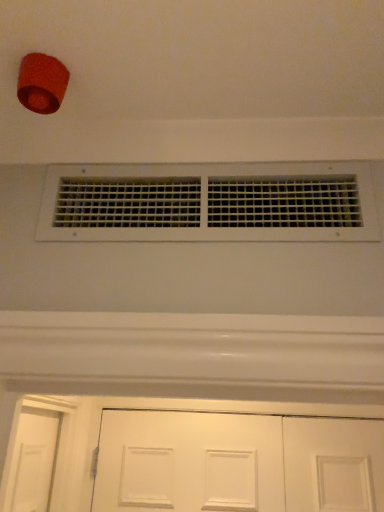
In order to click on white matte door at lower center in this screenshot , I will do `click(237, 462)`.

Describe the element at coordinates (237, 462) in the screenshot. I see `white matte door at lower center` at that location.

Locate an element on the screen. white plastic vents at center is located at coordinates (209, 203).

Describe the element at coordinates (209, 203) in the screenshot. I see `white plastic vents at center` at that location.

You are a GUI agent. You are given a task and a screenshot of the screen. Output one action in this format:
    pyautogui.click(x=<x>, y=<y>)
    Task: Click on the white matte door at lower center
    This screenshot has width=384, height=512.
    Given the screenshot: What is the action you would take?
    pyautogui.click(x=237, y=462)

Between white plastic vents at center and white matte door at lower center, which one appears on the left side from the viewer's perspective?

white plastic vents at center.

Is the depth of white plastic vents at center greater than that of white matte door at lower center?

No.

From the picture: Which point is more distant from viewer, (329, 229) or (262, 438)?

The point (262, 438) is farther.

From the image's perspective, between white plastic vents at center and white matte door at lower center, who is located below?

From the image's view, white matte door at lower center is below.

From a real-world perspective, is white plastic vents at center physically located above or below white matte door at lower center?

white plastic vents at center is situated higher than white matte door at lower center in the real world.

Considering the relative sizes of white plastic vents at center and white matte door at lower center in the image provided, is white plastic vents at center wider than white matte door at lower center?

No, white plastic vents at center is not wider than white matte door at lower center.

Is white plastic vents at center taller than white matte door at lower center?

In fact, white plastic vents at center may be shorter than white matte door at lower center.

Looking at this image, can you confirm if white plastic vents at center is bigger than white matte door at lower center?

Incorrect, white plastic vents at center is not larger than white matte door at lower center.

In the scene shown: Is white plastic vents at center positioned beyond the bounds of white matte door at lower center?

white plastic vents at center is positioned outside white matte door at lower center.

Consider the image. Is white plastic vents at center beside white matte door at lower center?

They are not placed beside each other.

Is white plastic vents at center positioned with its back to white matte door at lower center?

No, white plastic vents at center is not facing the opposite direction of white matte door at lower center.

How different are the orientations of white plastic vents at center and white matte door at lower center in degrees?

0.237 degrees.

Identify the location of window in front of the white matte door at lower center. (209, 203).

Between white matte door at lower center and white plastic vents at center, which one appears on the left side from the viewer's perspective?

white plastic vents at center.

Who is more distant, white matte door at lower center or white plastic vents at center?

Positioned behind is white matte door at lower center.

Considering the points (317, 444) and (157, 215), which point is in front, point (317, 444) or point (157, 215)?

The point (157, 215) is in front.

From the image's perspective, which is below, white matte door at lower center or white plastic vents at center?

From the image's view, white matte door at lower center is below.

From a real-world perspective, which object stands above the other?

white plastic vents at center, from a real-world perspective.

Looking at their sizes, would you say white matte door at lower center is wider or thinner than white plastic vents at center?

Clearly, white matte door at lower center has more width compared to white plastic vents at center.

Is white matte door at lower center taller than white plastic vents at center?

Correct, white matte door at lower center is much taller as white plastic vents at center.

Between white matte door at lower center and white plastic vents at center, which one has larger size?

Bigger between the two is white matte door at lower center.

Which is correct: white matte door at lower center is inside white plastic vents at center, or outside of it?

white matte door at lower center is located beyond the bounds of white plastic vents at center.

Would you consider white matte door at lower center to be distant from white plastic vents at center?

Absolutely, white matte door at lower center is distant from white plastic vents at center.

Looking at this image, is white matte door at lower center positioned with its back to white plastic vents at center?

No, white matte door at lower center is not facing away from white plastic vents at center.

Can you tell me how much white matte door at lower center and white plastic vents at center differ in facing direction?

The angular difference between white matte door at lower center and white plastic vents at center is 0.237 degrees.

How distant is white matte door at lower center from white plastic vents at center?

3.84 feet.

I want to click on window above the white matte door at lower center (from the image's perspective), so click(x=209, y=203).

The height and width of the screenshot is (512, 384). Identify the location of door that is on the right side of white plastic vents at center. (237, 462).

The image size is (384, 512). What are the coordinates of `window that is in front of the white matte door at lower center` in the screenshot? It's located at (209, 203).